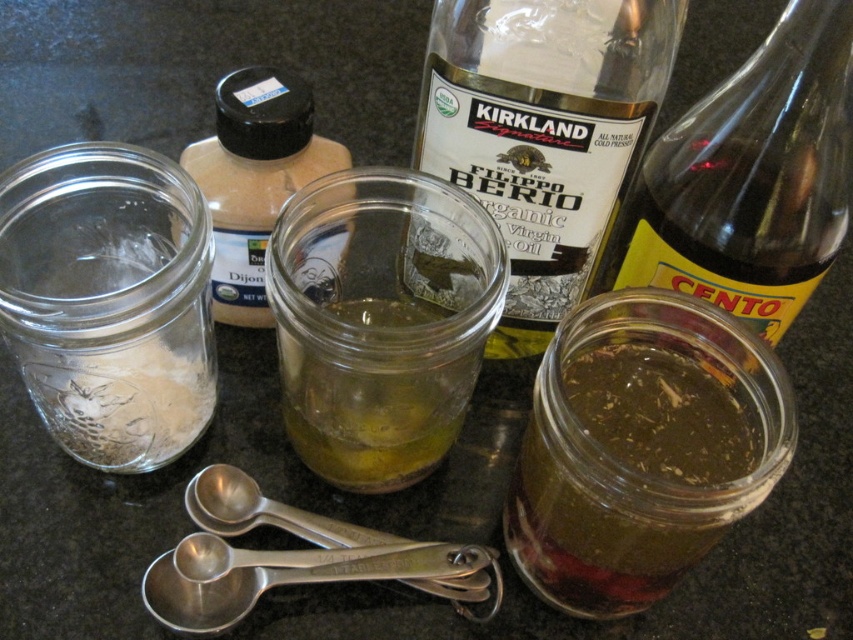
Question: Is transparent glass bottle at right further to camera compared to green gelatinous substance at center?

Choices:
 (A) yes
 (B) no

Answer: (A)

Question: Which point is farther to the camera?

Choices:
 (A) silver metallic measuring spoons at center
 (B) green translucent liquid at center right

Answer: (A)

Question: Among these objects, which one is nearest to the camera?

Choices:
 (A) clear glass bottle at center
 (B) silver metallic measuring spoons at center
 (C) green translucent liquid at center right
 (D) clear glass jar at upper left

Answer: (C)

Question: From the image, what is the correct spatial relationship of clear glass jar at left in relation to green gelatinous substance at center?

Choices:
 (A) right
 (B) left

Answer: (B)

Question: Which object is positioned closest to the clear glass jar at upper left?

Choices:
 (A) green gelatinous substance at center
 (B) silver metallic measuring spoons at lower center
 (C) green translucent liquid at center right
 (D) translucent glass jar at center

Answer: (D)

Question: Can you confirm if clear glass jar at upper left is positioned to the right of green gelatinous substance at center?

Choices:
 (A) no
 (B) yes

Answer: (A)